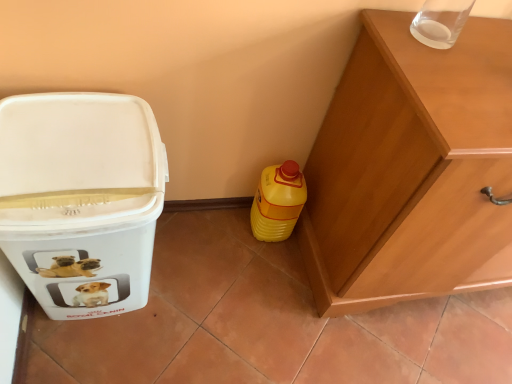
The width and height of the screenshot is (512, 384). I want to click on vacant area that is in front of yellow plastic bottle at lower right, so click(254, 265).